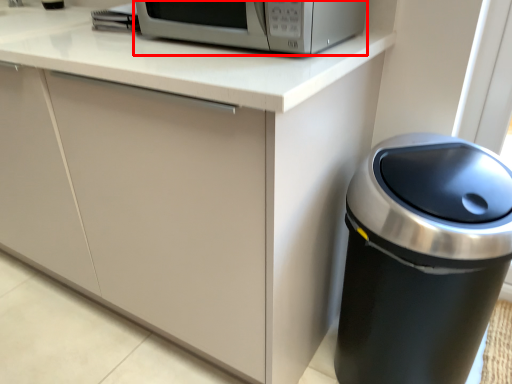
Question: From the image's perspective, what is the correct spatial positioning of home appliance (annotated by the red box) in reference to waste container?

Choices:
 (A) below
 (B) above

Answer: (B)